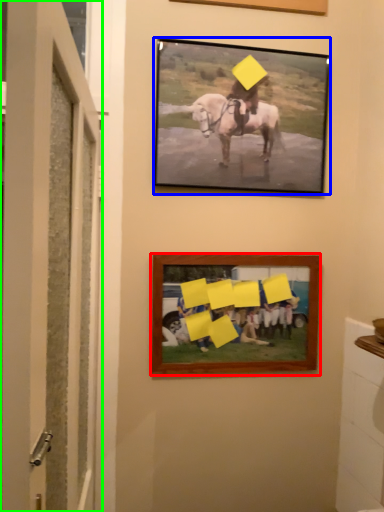
Question: Based on their relative distances, which object is farther from picture frame (highlighted by a red box)? Choose from picture frame (highlighted by a blue box) and door (highlighted by a green box).

Choices:
 (A) picture frame
 (B) door

Answer: (B)